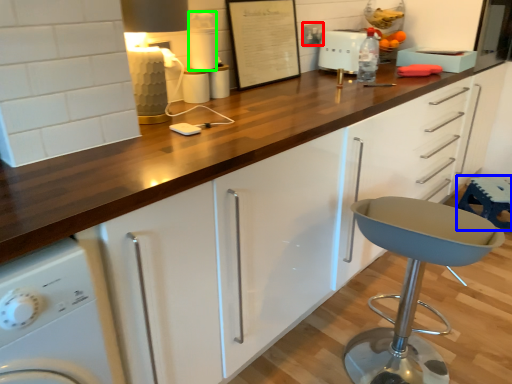
Question: Which object is the farthest from electric outlet (highlighted by a red box)? Choose among these: bar stool (highlighted by a blue box) or appliance (highlighted by a green box).

Choices:
 (A) bar stool
 (B) appliance

Answer: (A)